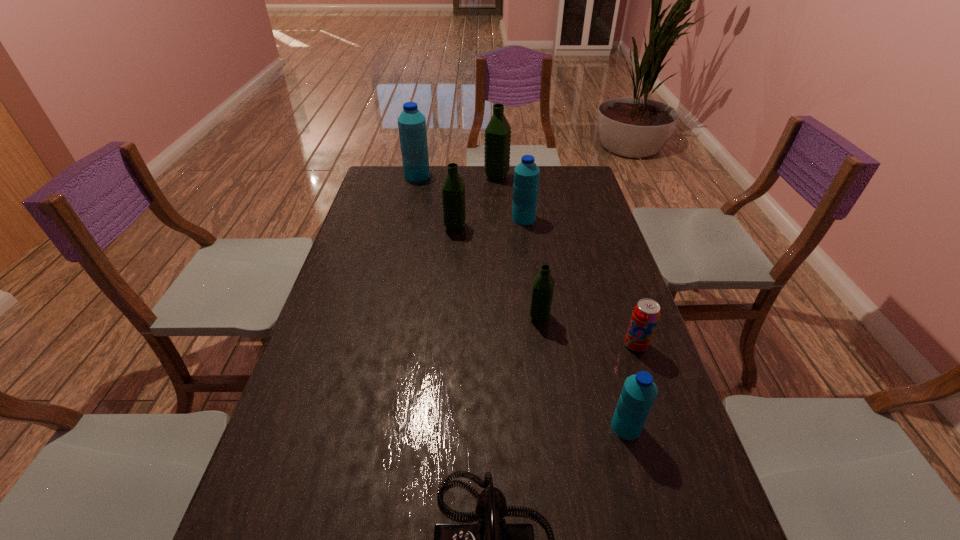
Find the location of a particular element. free space located 0.230m on the front of the soda can is located at coordinates (667, 437).

This screenshot has height=540, width=960. In order to click on object present at the left edge in this screenshot , I will do `click(411, 123)`.

Find the location of a particular element. Image resolution: width=960 pixels, height=540 pixels. water bottle that is at the right edge is located at coordinates (639, 391).

You are a GUI agent. You are given a task and a screenshot of the screen. Output one action in this format:
    pyautogui.click(x=<x>, y=<y>)
    Task: Click on the soda can at the right edge
    The width and height of the screenshot is (960, 540).
    Given the screenshot: What is the action you would take?
    (646, 313)

You are a GUI agent. You are given a task and a screenshot of the screen. Output one action in this format:
    pyautogui.click(x=<x>, y=<y>)
    Task: Click on the object that is at the far left corner
    The width and height of the screenshot is (960, 540).
    Given the screenshot: What is the action you would take?
    pyautogui.click(x=411, y=123)

The image size is (960, 540). What are the coordinates of `vacant area at the far edge` in the screenshot? It's located at (433, 171).

At what (x,y) coordinates should I click in order to perform the action: click on vacant space at the left edge. Please return your answer as a coordinate pair (x, y). The image size is (960, 540). Looking at the image, I should click on (346, 295).

Locate an element on the screen. This screenshot has width=960, height=540. vacant space at the right edge is located at coordinates (599, 259).

The image size is (960, 540). What are the coordinates of `blank space at the far left corner of the desktop` in the screenshot? It's located at (396, 194).

Where is `vacant region at the far right corner`? The width and height of the screenshot is (960, 540). vacant region at the far right corner is located at coordinates (559, 194).